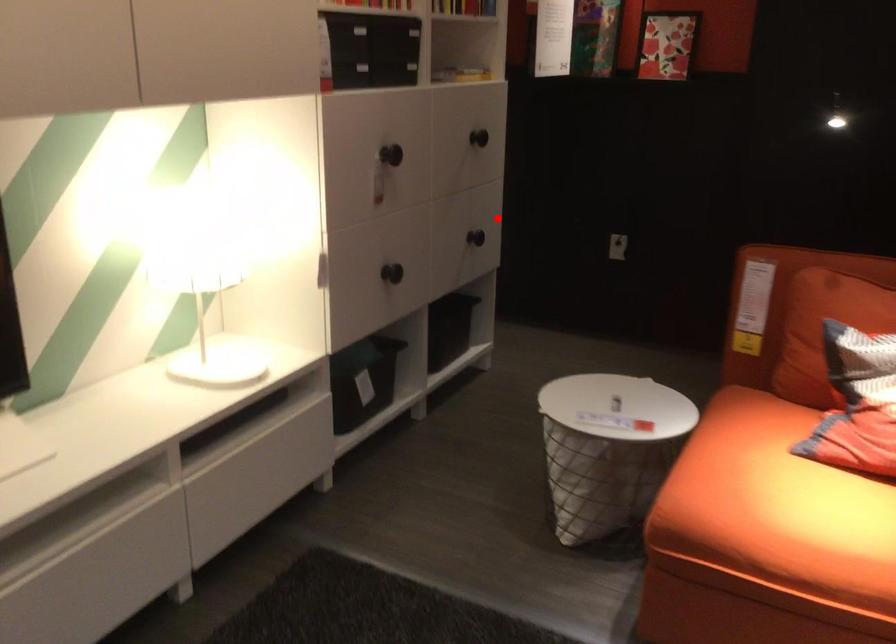
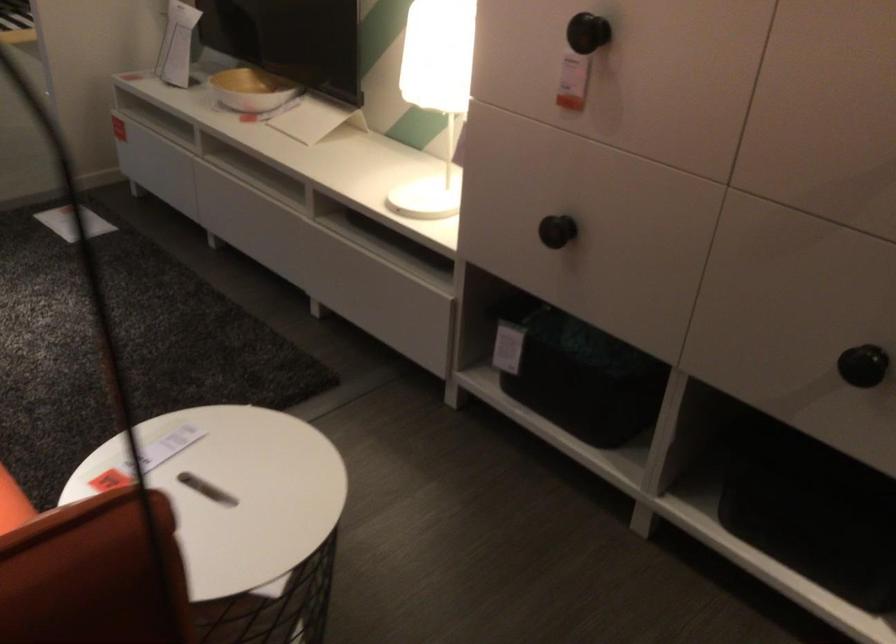
Find the pixel in the second image that matches the highlighted location in the first image.

(863, 365)